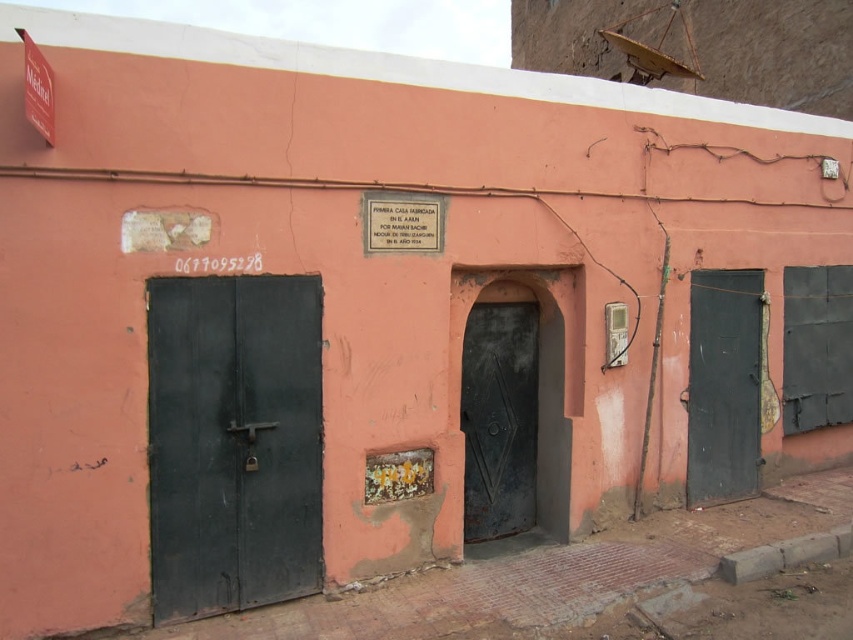
Is point (479, 376) more distant than point (746, 289)?

No, it is in front of (746, 289).

Identify the location of rusty metal door at center. (498, 419).

Who is more forward, (508, 531) or (726, 308)?

Point (508, 531)

I want to click on rusty metal door at center, so click(498, 419).

Identify the location of matte black door at left. (233, 442).

Does matte black door at left appear on the left side of matte black door at right?

Indeed, matte black door at left is positioned on the left side of matte black door at right.

Is point (160, 541) closer to camera compared to point (735, 388)?

Yes, it is in front of point (735, 388).

Identify the location of matte black door at left. This screenshot has width=853, height=640. (233, 442).

From the picture: Does matte black door at left have a larger size compared to rusty metal door at center?

Yes, matte black door at left is bigger than rusty metal door at center.

Identify the location of matte black door at left. The image size is (853, 640). (233, 442).

The width and height of the screenshot is (853, 640). What are the coordinates of `matte black door at left` in the screenshot? It's located at (233, 442).